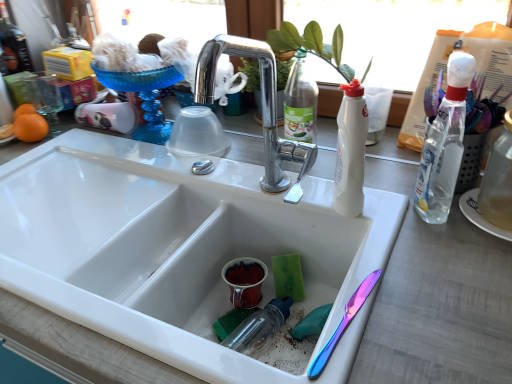
The image size is (512, 384). I want to click on free space in front of white matte bottle at center, which appears as the 1th bottle when viewed from the left, so click(404, 266).